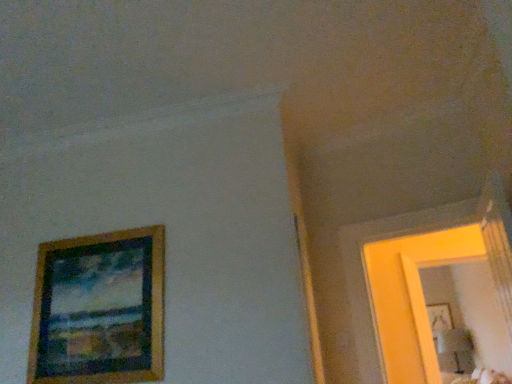
Question: Is wooden picture frame at upper right, the first picture frame in the bottom-to-top sequence, not near wooden picture frame at left, the second picture frame viewed from the right?

Choices:
 (A) no
 (B) yes

Answer: (B)

Question: Is wooden picture frame at left, the second picture frame viewed from the right, at the back of wooden picture frame at upper right, the second picture frame in the left-to-right sequence?

Choices:
 (A) yes
 (B) no

Answer: (B)

Question: Is wooden picture frame at upper right, the 1th picture frame from the back, beside wooden picture frame at left, the first picture frame in the front-to-back sequence?

Choices:
 (A) no
 (B) yes

Answer: (A)

Question: Is wooden picture frame at upper right, the first picture frame when ordered from right to left, outside of wooden picture frame at left, arranged as the first picture frame when viewed from the top?

Choices:
 (A) no
 (B) yes

Answer: (B)

Question: From the image's perspective, is wooden picture frame at upper right, the first picture frame when ordered from right to left, located above wooden picture frame at left, positioned as the 2th picture frame in bottom-to-top order?

Choices:
 (A) yes
 (B) no

Answer: (B)

Question: Considering the positions of point (441, 292) and point (59, 274), is point (441, 292) closer or farther from the camera than point (59, 274)?

Choices:
 (A) closer
 (B) farther

Answer: (B)

Question: Considering the positions of matte yellow mirror at right and wooden picture frame at left, positioned as the 2th picture frame in bottom-to-top order, in the image, is matte yellow mirror at right wider or thinner than wooden picture frame at left, positioned as the 2th picture frame in bottom-to-top order,?

Choices:
 (A) thin
 (B) wide

Answer: (B)

Question: Do you think matte yellow mirror at right is within wooden picture frame at left, the second picture frame viewed from the right, or outside of it?

Choices:
 (A) inside
 (B) outside

Answer: (B)

Question: From the image's perspective, relative to wooden picture frame at left, the first picture frame in the front-to-back sequence, is matte yellow mirror at right above or below?

Choices:
 (A) below
 (B) above

Answer: (A)

Question: Is wooden picture frame at upper right, the first picture frame in the bottom-to-top sequence, wider or thinner than wooden picture frame at left, the first picture frame in the front-to-back sequence?

Choices:
 (A) wide
 (B) thin

Answer: (B)

Question: Choose the correct answer: Is wooden picture frame at upper right, the first picture frame in the bottom-to-top sequence, inside wooden picture frame at left, arranged as the first picture frame when viewed from the top, or outside it?

Choices:
 (A) outside
 (B) inside

Answer: (A)

Question: Considering their positions, is wooden picture frame at upper right, the second picture frame in the left-to-right sequence, located in front of or behind wooden picture frame at left, positioned as the 2th picture frame in bottom-to-top order?

Choices:
 (A) behind
 (B) front

Answer: (A)

Question: From the image's perspective, relative to wooden picture frame at left, which ranks as the 2th picture frame in back-to-front order, is wooden picture frame at upper right, the first picture frame when ordered from right to left, above or below?

Choices:
 (A) below
 (B) above

Answer: (A)

Question: Choose the correct answer: Is matte yellow mirror at right inside wooden picture frame at upper right, which is the second picture frame in front-to-back order, or outside it?

Choices:
 (A) outside
 (B) inside

Answer: (A)

Question: Based on their sizes in the image, would you say matte yellow mirror at right is bigger or smaller than wooden picture frame at upper right, acting as the 2th picture frame starting from the top?

Choices:
 (A) small
 (B) big

Answer: (B)